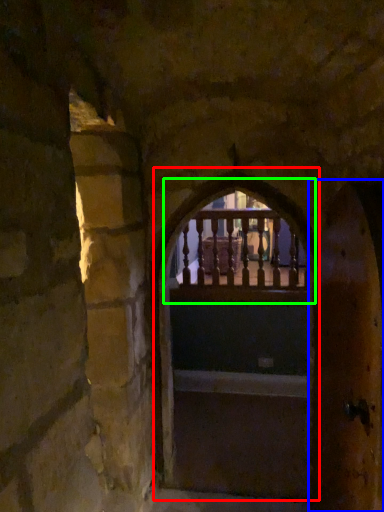
Question: Estimate the real-world distances between objects in this image. Which object is farther from archway (highlighted by a red box), door (highlighted by a blue box) or window (highlighted by a green box)?

Choices:
 (A) door
 (B) window

Answer: (A)